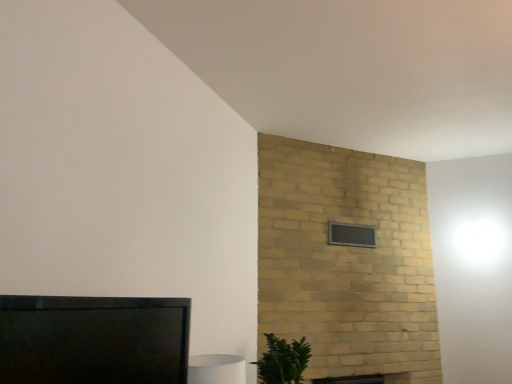
Question: From a real-world perspective, is black glass window at upper center physically located above or below matte black tv at lower left?

Choices:
 (A) below
 (B) above

Answer: (B)

Question: From the image's perspective, is black glass window at upper center above or below matte black tv at lower left?

Choices:
 (A) below
 (B) above

Answer: (B)

Question: Estimate the real-world distances between objects in this image. Which object is closer to the green leafy plant at lower right?

Choices:
 (A) black glass window at upper center
 (B) matte black tv at lower left

Answer: (A)

Question: Based on their relative distances, which object is farther from the green leafy plant at lower right?

Choices:
 (A) matte black tv at lower left
 (B) black glass window at upper center

Answer: (A)